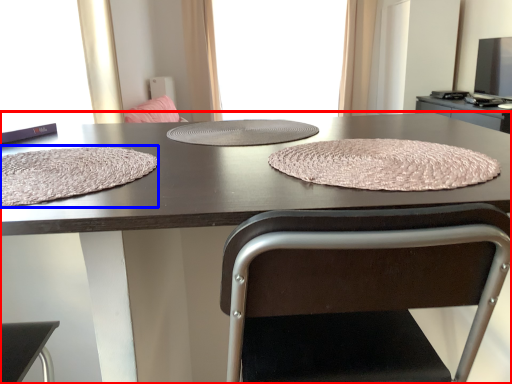
Question: Which of the following is the closest to the observer, table (highlighted by a red box) or blanket (highlighted by a blue box)?

Choices:
 (A) table
 (B) blanket

Answer: (A)